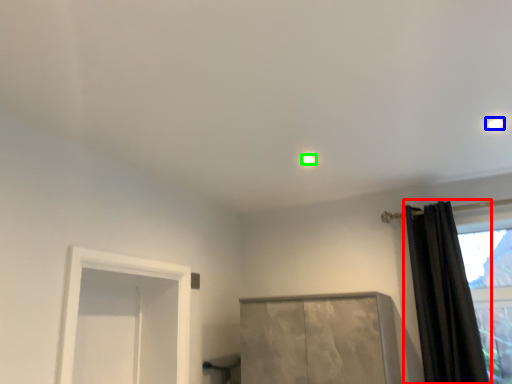
Question: Considering the real-world distances, which object is closest to curtain (highlighted by a red box)? lighting (highlighted by a blue box) or lighting (highlighted by a green box).

Choices:
 (A) lighting
 (B) lighting

Answer: (A)